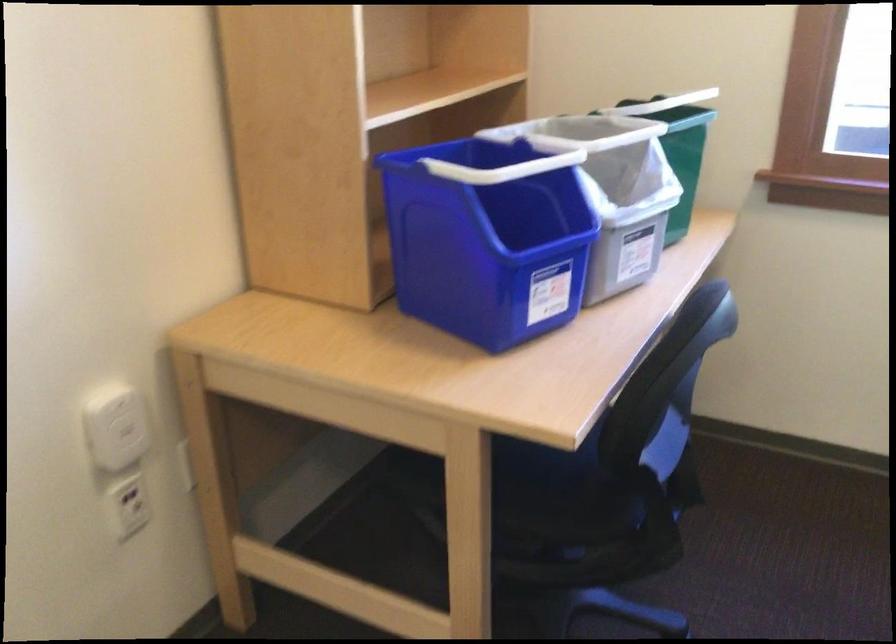
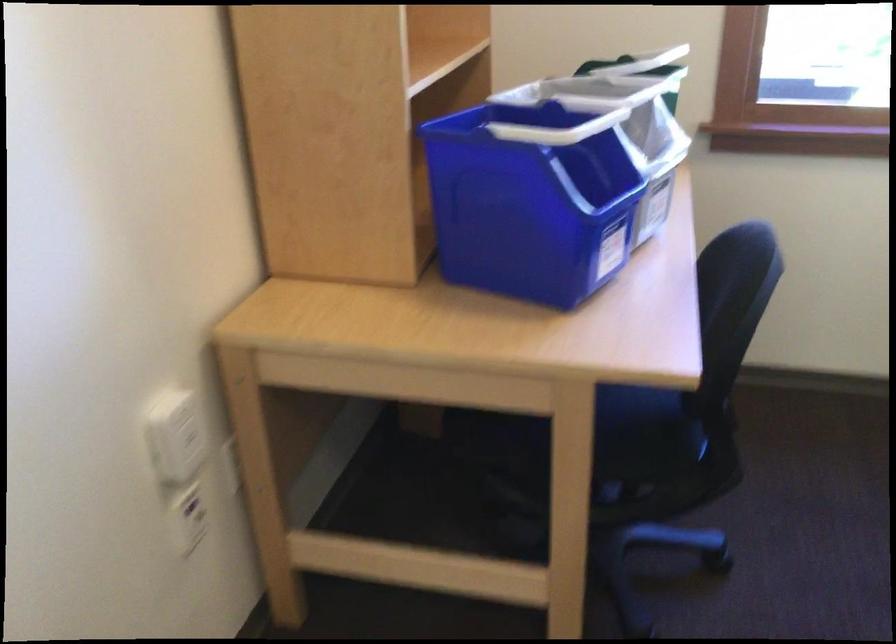
Find the pixel in the second image that matches the point at 110,424 in the first image.

(174, 435)